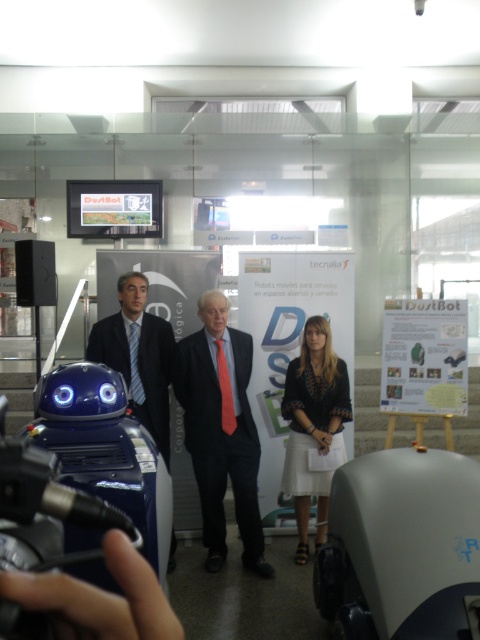
Question: Among these points, which one is farthest from the camera?

Choices:
 (A) (91, 333)
 (B) (324, 440)

Answer: (A)

Question: Is matte black suit at center wider than black textured blouse at center?

Choices:
 (A) no
 (B) yes

Answer: (B)

Question: Is black textured blouse at center closer to the viewer compared to blue silk suit at center?

Choices:
 (A) yes
 (B) no

Answer: (B)

Question: Which of the following is the farthest from the observer?

Choices:
 (A) (314, 433)
 (B) (165, 442)

Answer: (B)

Question: Which point is farther to the camera?

Choices:
 (A) (296, 561)
 (B) (251, 544)
 (C) (135, 323)

Answer: (C)

Question: Does black textured blouse at center lie behind blue silk suit at center?

Choices:
 (A) yes
 (B) no

Answer: (A)